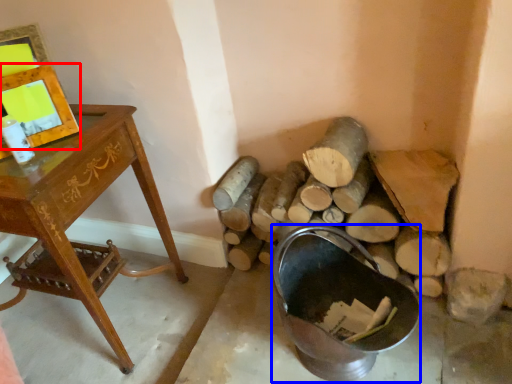
Question: Which object appears farthest to the camera in this image, picture frame (highlighted by a red box) or basin (highlighted by a blue box)?

Choices:
 (A) picture frame
 (B) basin

Answer: (A)